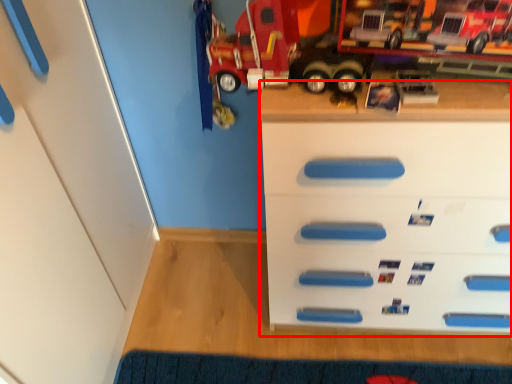
Question: Observing the image, what is the correct spatial positioning of chest of drawers (annotated by the red box) in reference to doormat?

Choices:
 (A) left
 (B) right

Answer: (B)